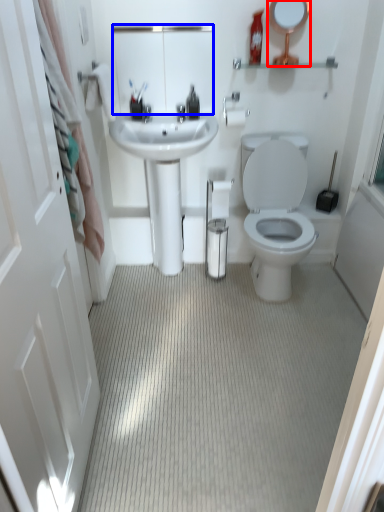
Question: Among these objects, which one is nearest to the camera, mirror (highlighted by a red box) or mirror (highlighted by a blue box)?

Choices:
 (A) mirror
 (B) mirror

Answer: (A)